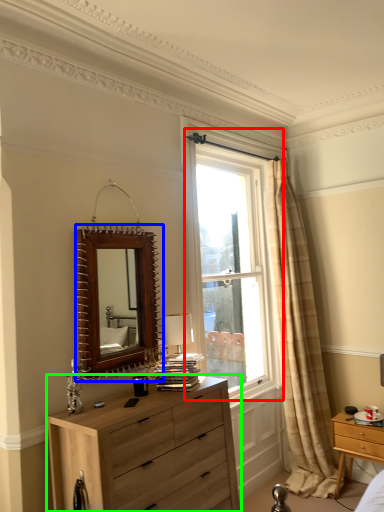
Question: Estimate the real-world distances between objects in this image. Which object is farther from window (highlighted by a red box), mirror (highlighted by a blue box) or chest of drawers (highlighted by a green box)?

Choices:
 (A) mirror
 (B) chest of drawers

Answer: (B)